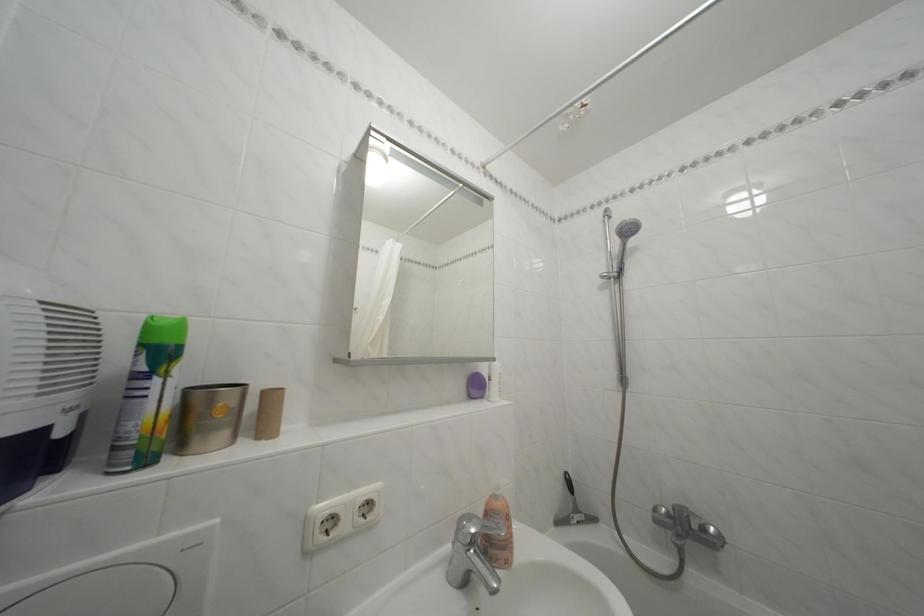
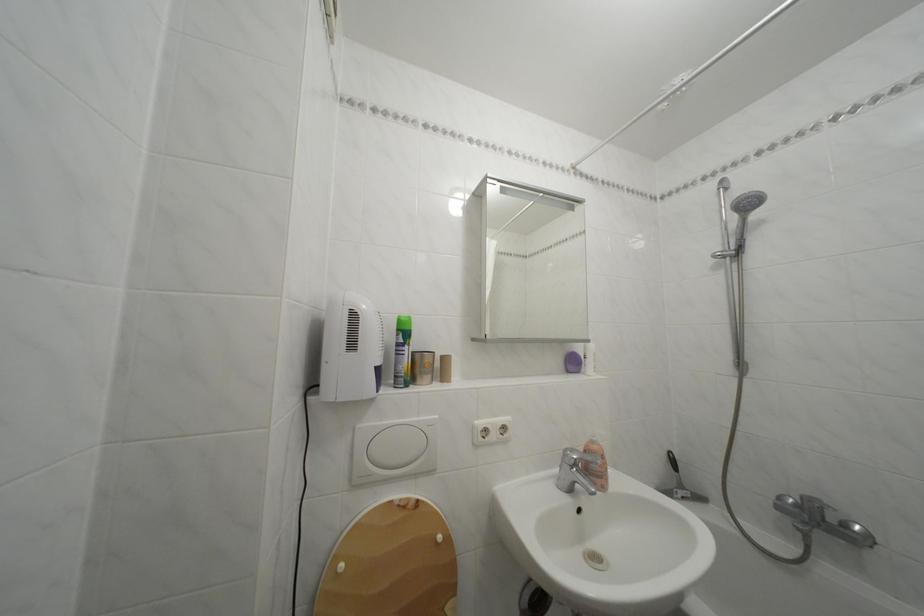
The point at (x=150, y=351) is marked in the first image. Where is the corresponding point in the second image?

(407, 336)